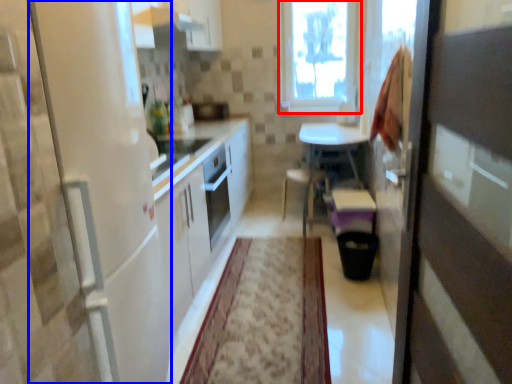
Question: Among these objects, which one is nearest to the camera, window (highlighted by a red box) or screen door (highlighted by a blue box)?

Choices:
 (A) window
 (B) screen door

Answer: (B)